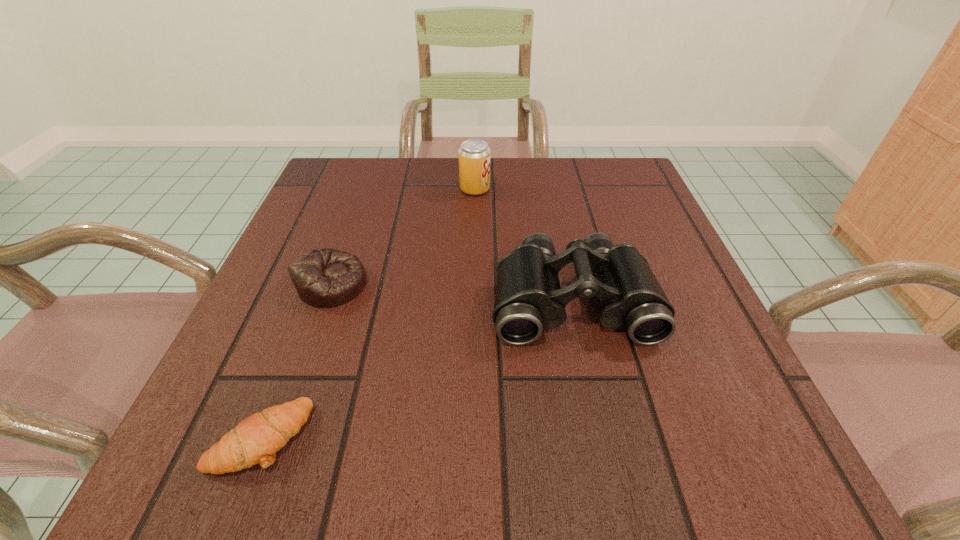
Identify which object is the closest to the third tallest object. Please provide its 2D coordinates. Your answer should be formatted as a tuple, i.e. [(x, y)], where the tuple contains the x and y coordinates of a point satisfying the conditions above.

[(256, 439)]

In order to click on free space that satisfies the following two spatial constraints: 1. on the back side of the third tallest object; 2. on the left side of the crescent roll in this screenshot , I will do `click(320, 284)`.